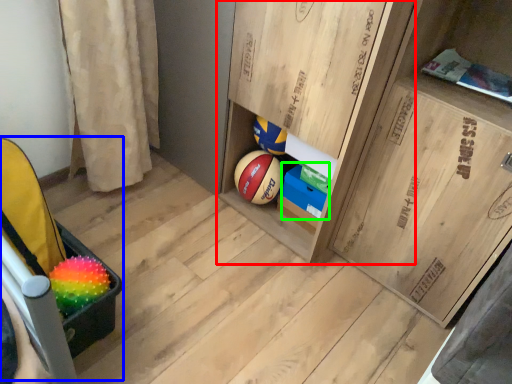
Question: Based on their relative distances, which object is farther from cabinetry (highlighted by a red box)? Choose from baby carriage (highlighted by a blue box) and cabinetry (highlighted by a green box).

Choices:
 (A) baby carriage
 (B) cabinetry

Answer: (A)